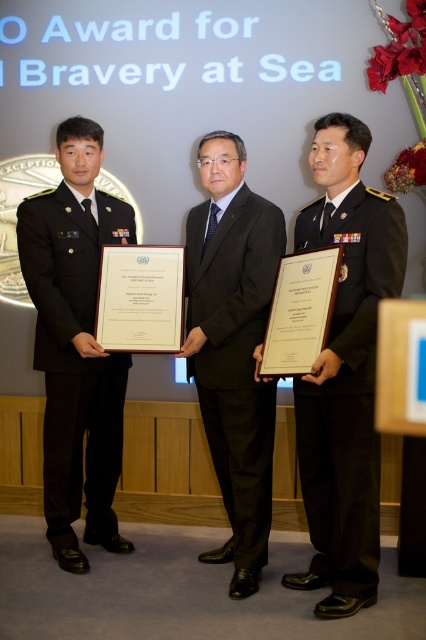
Question: Which object is the farthest from the dark green uniform at center?

Choices:
 (A) black uniform at center
 (B) black uniform at left

Answer: (B)

Question: Which object is positioned closest to the black uniform at center?

Choices:
 (A) dark green uniform at center
 (B) black uniform at left

Answer: (A)

Question: Is dark green uniform at center bigger than black uniform at left?

Choices:
 (A) no
 (B) yes

Answer: (A)

Question: Which point is closer to the camera taking this photo?

Choices:
 (A) (51, 474)
 (B) (336, 308)

Answer: (B)

Question: Where is dark green uniform at center located in relation to black uniform at left in the image?

Choices:
 (A) below
 (B) above

Answer: (A)

Question: Is dark green uniform at center closer to the viewer compared to black uniform at center?

Choices:
 (A) no
 (B) yes

Answer: (B)